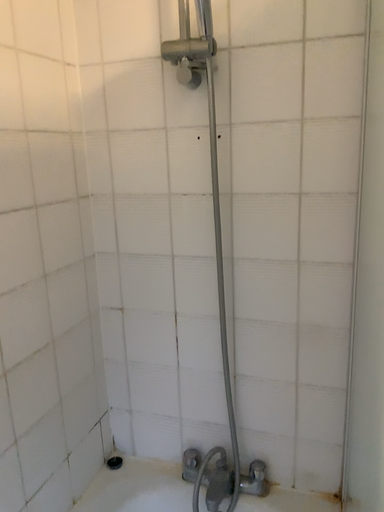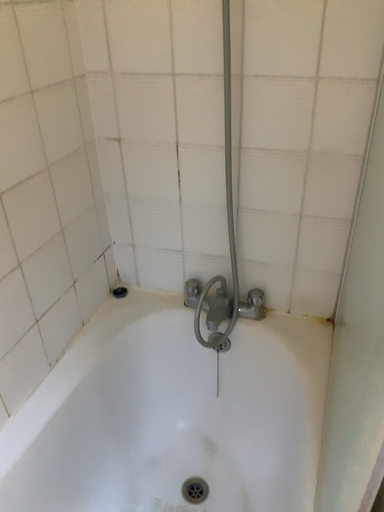
Question: How did the camera likely rotate when shooting the video?

Choices:
 (A) rotated upward
 (B) rotated downward

Answer: (B)